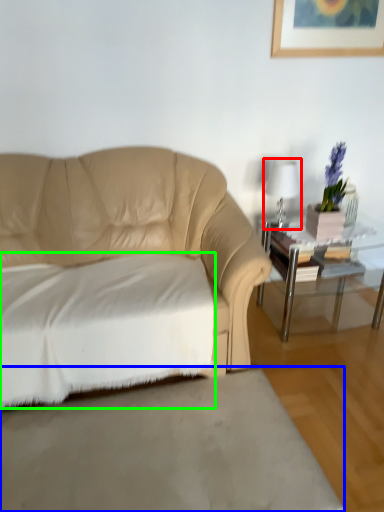
Question: Which object is positioned farthest from table lamp (highlighted by a red box)? Select from concrete (highlighted by a blue box) and sheet (highlighted by a green box).

Choices:
 (A) concrete
 (B) sheet

Answer: (A)